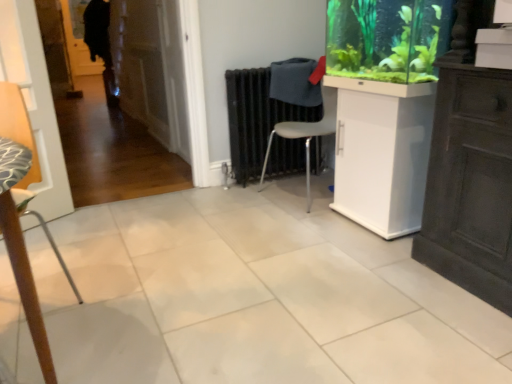
Question: Does point (10, 236) appear closer or farther from the camera than point (366, 172)?

Choices:
 (A) closer
 (B) farther

Answer: (A)

Question: Is wooden textured chair at left, which ranks as the 1th chair in left-to-right order, inside the boundaries of white glossy cabinet at center right, or outside?

Choices:
 (A) outside
 (B) inside

Answer: (A)

Question: Which of these objects is positioned farthest from the white glossy cabinet at center right?

Choices:
 (A) gray plastic chair at center, which is counted as the 1th chair, starting from the right
 (B) wooden textured chair at left, which is counted as the first chair, starting from the front
 (C) green glossy aquarium at upper right
 (D) black metal radiator at center

Answer: (B)

Question: Based on their relative distances, which object is nearer to the green glossy aquarium at upper right?

Choices:
 (A) gray plastic chair at center, marked as the first chair in a back-to-front arrangement
 (B) wooden textured chair at left, which is counted as the first chair, starting from the front
 (C) black metal radiator at center
 (D) white glossy cabinet at center right

Answer: (D)